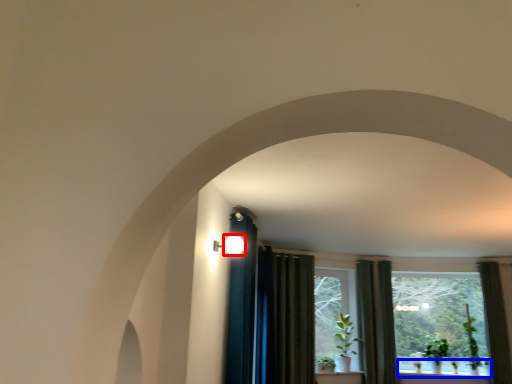
Question: Which point is closer to the camera, light (highlighted by a red box) or window sill (highlighted by a blue box)?

Choices:
 (A) light
 (B) window sill

Answer: (A)